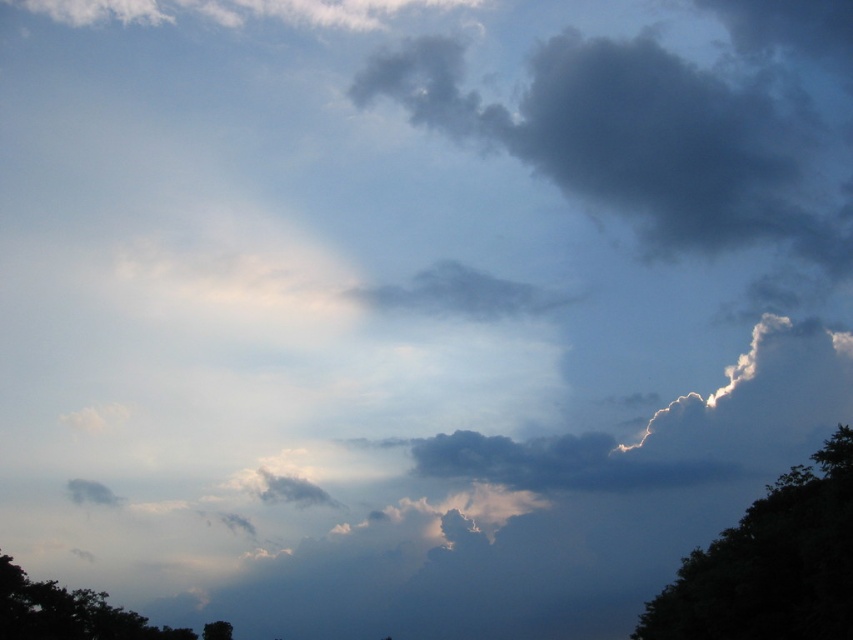
The image size is (853, 640). Describe the element at coordinates (770, 563) in the screenshot. I see `dark green leafy tree at right` at that location.

Image resolution: width=853 pixels, height=640 pixels. I want to click on dark green leafy tree at right, so click(770, 563).

Does point (822, 566) come behind point (225, 625)?

That is False.

I want to click on dark green leafy tree at right, so click(x=770, y=563).

Between point (653, 182) and point (695, 564), which one is positioned behind?

The point (653, 182) is more distant.

Can you confirm if dark gray fluffy cloud at upper center is positioned to the left of dark green leafy tree at right?

In fact, dark gray fluffy cloud at upper center is to the right of dark green leafy tree at right.

Which is behind, point (701, 83) or point (700, 564)?

Point (701, 83)

Find the location of a particular element. The height and width of the screenshot is (640, 853). dark gray fluffy cloud at upper center is located at coordinates (639, 140).

Is dark gray fluffy cloud at upper center behind dark green leafy tree at bottom left?

Yes, it is.

Does point (422, 36) come in front of point (80, 592)?

No, it is not.

Is point (602, 177) positioned in front of point (39, 586)?

No, (602, 177) is further to viewer.

Locate an element on the screen. The image size is (853, 640). dark gray fluffy cloud at upper center is located at coordinates tap(639, 140).